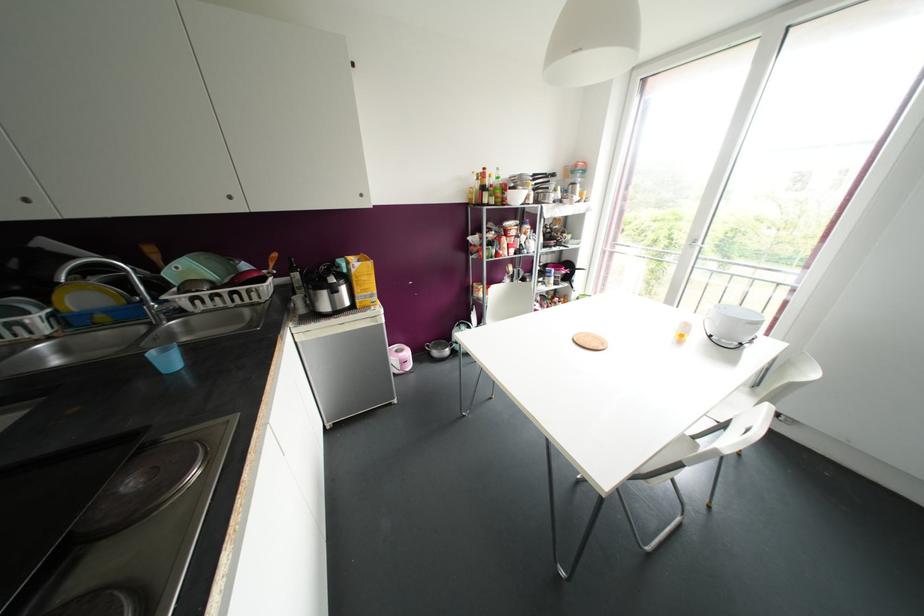
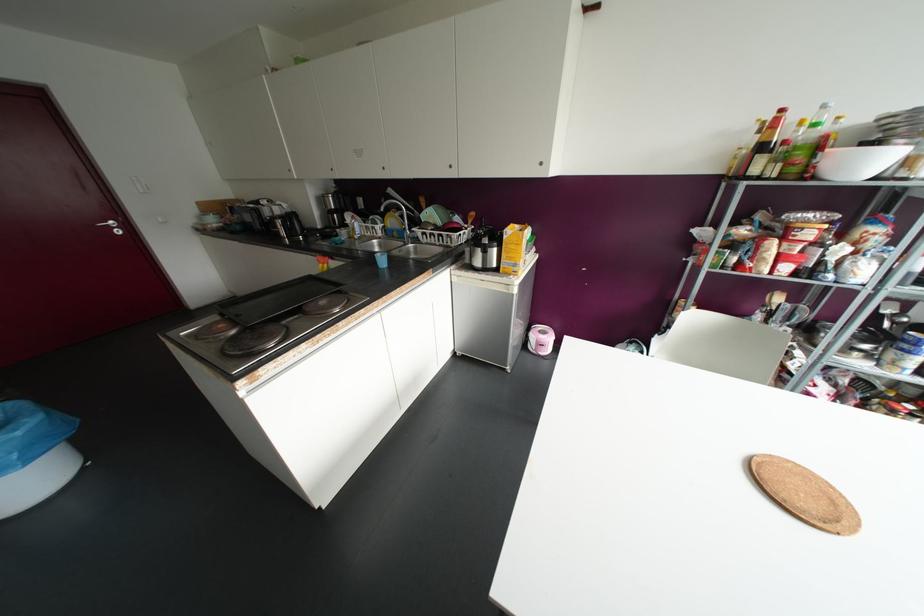
Where in the second image is the point corresponding to (496,169) from the first image?

(823, 106)